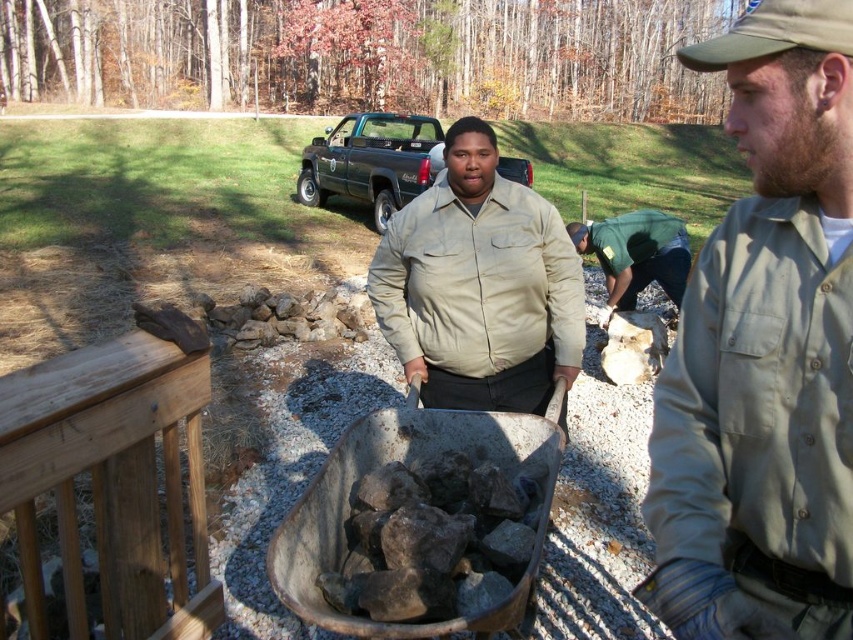
Consider the image. Can you confirm if khaki button-up shirt at center is wider than green uniform at center?

Incorrect, khaki button-up shirt at center's width does not surpass green uniform at center's.

Who is more forward, (843,17) or (647,240)?

Point (843,17) is more forward.

The width and height of the screenshot is (853, 640). I want to click on khaki button-up shirt at center, so click(764, 355).

Is tan fabric shirt at center below green uniform at center?

Indeed, tan fabric shirt at center is positioned under green uniform at center.

Between point (508, 248) and point (682, 260), which one is positioned in front?

Positioned in front is point (508, 248).

Identify the location of tan fabric shirt at center. The width and height of the screenshot is (853, 640). (479, 285).

Can you confirm if khaki button-up shirt at center is positioned below tan fabric shirt at center?

Yes, khaki button-up shirt at center is below tan fabric shirt at center.

The width and height of the screenshot is (853, 640). Find the location of `khaki button-up shirt at center`. khaki button-up shirt at center is located at coordinates (764, 355).

You are a GUI agent. You are given a task and a screenshot of the screen. Output one action in this format:
    pyautogui.click(x=<x>, y=<y>)
    Task: Click on the khaki button-up shirt at center
    This screenshot has width=853, height=640.
    Given the screenshot: What is the action you would take?
    pyautogui.click(x=764, y=355)

The width and height of the screenshot is (853, 640). What are the coordinates of `khaki button-up shirt at center` in the screenshot? It's located at (764, 355).